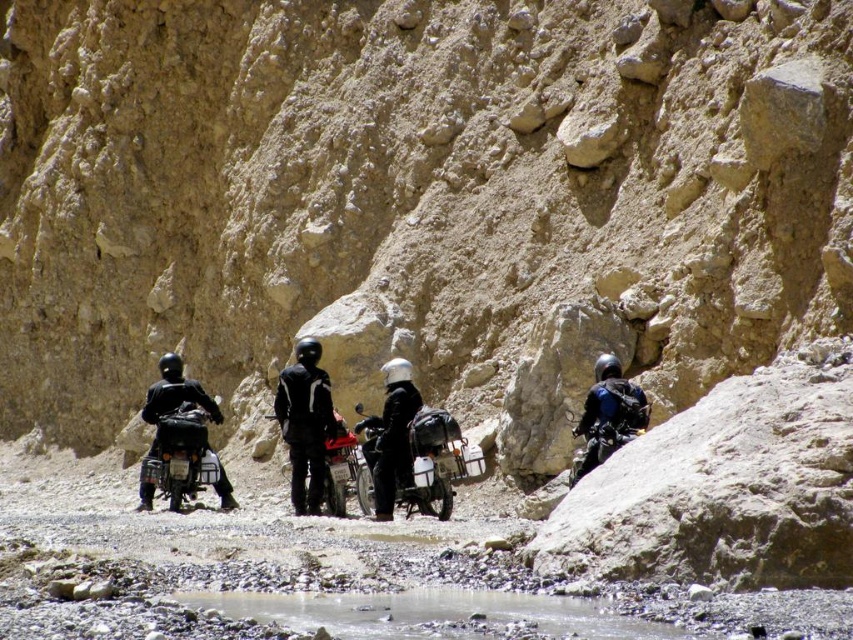
Which is in front, point (646, 412) or point (360, 500)?

Positioned in front is point (646, 412).

Does blue matte jacket at center have a greater height compared to metallic silver motorcycle at center?

Yes.

Between point (607, 424) and point (363, 499), which one is positioned behind?

Positioned behind is point (363, 499).

The image size is (853, 640). Identify the location of blue matte jacket at center. (608, 413).

Is black matte jacket at center bigger than blue matte jacket at center?

No, black matte jacket at center is not bigger than blue matte jacket at center.

Who is more forward, (289,435) or (602,358)?

Point (602,358) is more forward.

You are a GUI agent. You are given a task and a screenshot of the screen. Output one action in this format:
    pyautogui.click(x=<x>, y=<y>)
    Task: Click on the black matte jacket at center
    The image size is (853, 640).
    Given the screenshot: What is the action you would take?
    pyautogui.click(x=305, y=424)

Is matte black motorcycle at left bigger than white matte helmet at center?

Correct, matte black motorcycle at left is larger in size than white matte helmet at center.

Between matte black motorcycle at left and white matte helmet at center, which one appears on the right side from the viewer's perspective?

white matte helmet at center is more to the right.

Between point (143, 486) and point (393, 365), which one is positioned behind?

The point (143, 486) is behind.

In order to click on matte black motorcycle at left in this screenshot , I will do `click(183, 456)`.